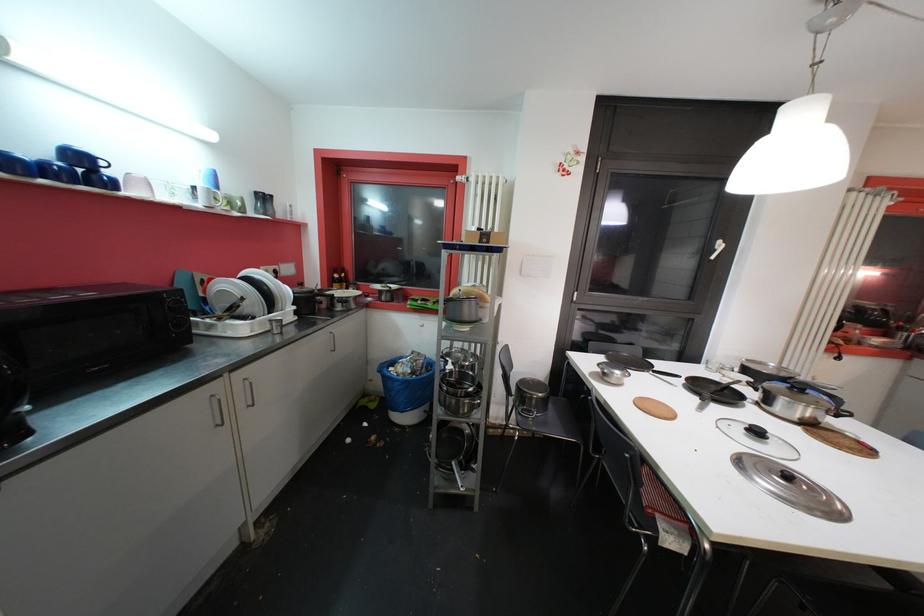
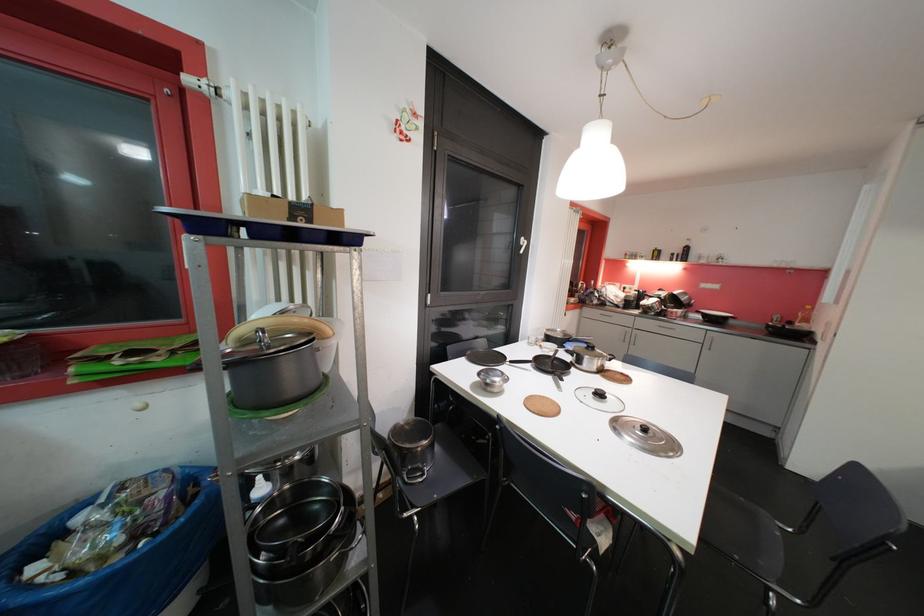
Where in the second image is the point corresponding to point 724,244 from the first image?

(528, 241)